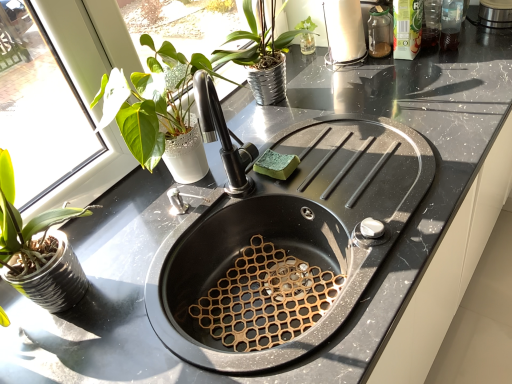
Question: Can you confirm if green sponge at sink is wider than white glossy paper towel holder at upper right?

Choices:
 (A) yes
 (B) no

Answer: (B)

Question: Is green sponge at sink facing towards white glossy paper towel holder at upper right?

Choices:
 (A) no
 (B) yes

Answer: (A)

Question: Can you confirm if green sponge at sink is shorter than white glossy paper towel holder at upper right?

Choices:
 (A) yes
 (B) no

Answer: (A)

Question: From a real-world perspective, is green sponge at sink physically above white glossy paper towel holder at upper right?

Choices:
 (A) no
 (B) yes

Answer: (A)

Question: Is green sponge at sink thinner than white glossy paper towel holder at upper right?

Choices:
 (A) no
 (B) yes

Answer: (B)

Question: Considering the relative positions of green sponge at sink and white glossy paper towel holder at upper right in the image provided, is green sponge at sink behind white glossy paper towel holder at upper right?

Choices:
 (A) yes
 (B) no

Answer: (B)

Question: Are green sponge at sink and black matte sink at center making contact?

Choices:
 (A) no
 (B) yes

Answer: (A)

Question: Can you confirm if green sponge at sink is wider than black matte sink at center?

Choices:
 (A) yes
 (B) no

Answer: (B)

Question: From the image's perspective, is green sponge at sink located beneath black matte sink at center?

Choices:
 (A) no
 (B) yes

Answer: (A)

Question: Does green sponge at sink have a greater height compared to black matte sink at center?

Choices:
 (A) yes
 (B) no

Answer: (B)

Question: Is green sponge at sink closer to camera compared to black matte sink at center?

Choices:
 (A) yes
 (B) no

Answer: (B)

Question: From a real-world perspective, is green sponge at sink physically below black matte sink at center?

Choices:
 (A) yes
 (B) no

Answer: (B)

Question: Can you confirm if white glossy paper towel holder at upper right is shorter than black matte sink at center?

Choices:
 (A) no
 (B) yes

Answer: (A)